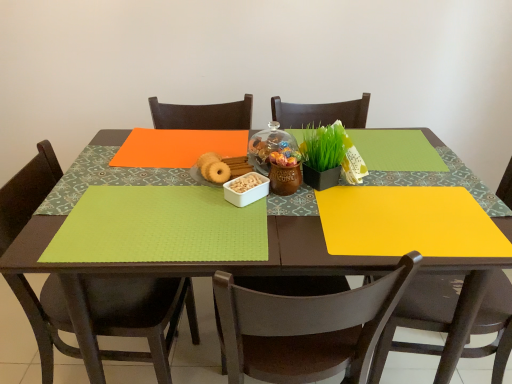
Question: Does lime green fabric placemat at lower left have a smaller size compared to transparent glass jar at center?

Choices:
 (A) yes
 (B) no

Answer: (A)

Question: From a real-world perspective, is lime green fabric placemat at lower left positioned under transparent glass jar at center based on gravity?

Choices:
 (A) yes
 (B) no

Answer: (A)

Question: Is lime green fabric placemat at lower left further to camera compared to transparent glass jar at center?

Choices:
 (A) no
 (B) yes

Answer: (A)

Question: Can you confirm if lime green fabric placemat at lower left is positioned to the right of transparent glass jar at center?

Choices:
 (A) no
 (B) yes

Answer: (A)

Question: Does lime green fabric placemat at lower left have a lesser height compared to transparent glass jar at center?

Choices:
 (A) yes
 (B) no

Answer: (A)

Question: From a real-world perspective, is lime green fabric placemat at lower left physically located above or below matte brown chair at lower right, positioned as the 1th chair in right-to-left order?

Choices:
 (A) above
 (B) below

Answer: (A)

Question: Is lime green fabric placemat at lower left taller or shorter than matte brown chair at lower right, positioned as the 1th chair in right-to-left order?

Choices:
 (A) short
 (B) tall

Answer: (A)

Question: Is lime green fabric placemat at lower left wider or thinner than matte brown chair at lower right, placed as the 3th chair when sorted from left to right?

Choices:
 (A) thin
 (B) wide

Answer: (A)

Question: Considering their positions, is lime green fabric placemat at lower left located in front of or behind matte brown chair at lower right, placed as the 3th chair when sorted from left to right?

Choices:
 (A) front
 (B) behind

Answer: (A)

Question: Is lime green fabric placemat at lower left wider or thinner than matte black chair at lower left, the first chair when ordered from left to right?

Choices:
 (A) wide
 (B) thin

Answer: (B)

Question: Is lime green fabric placemat at lower left spatially inside matte black chair at lower left, the first chair when ordered from left to right, or outside of it?

Choices:
 (A) inside
 (B) outside

Answer: (A)

Question: Considering the positions of lime green fabric placemat at lower left and matte black chair at lower left, the first chair when ordered from left to right, in the image, is lime green fabric placemat at lower left taller or shorter than matte black chair at lower left, the first chair when ordered from left to right,?

Choices:
 (A) tall
 (B) short

Answer: (B)

Question: In terms of size, does lime green fabric placemat at lower left appear bigger or smaller than matte black chair at lower left, which ranks as the 3th chair in right-to-left order?

Choices:
 (A) small
 (B) big

Answer: (A)

Question: From the image's perspective, relative to matte brown chair at lower right, positioned as the 1th chair in right-to-left order, is green matte plant at center above or below?

Choices:
 (A) below
 (B) above

Answer: (B)

Question: Would you say green matte plant at center is to the left or to the right of matte brown chair at lower right, positioned as the 1th chair in right-to-left order, in the picture?

Choices:
 (A) left
 (B) right

Answer: (A)